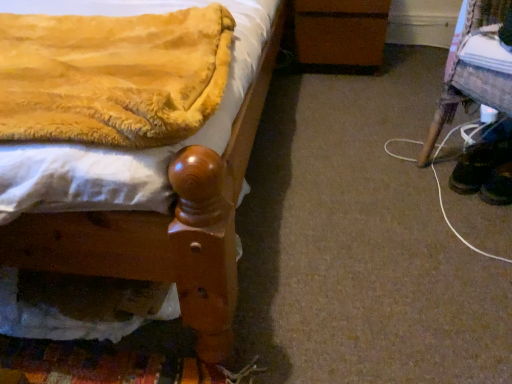
Locate an element on the screen. The image size is (512, 384). vacant area located to the right-hand side of brown wooden changing table at center is located at coordinates (409, 59).